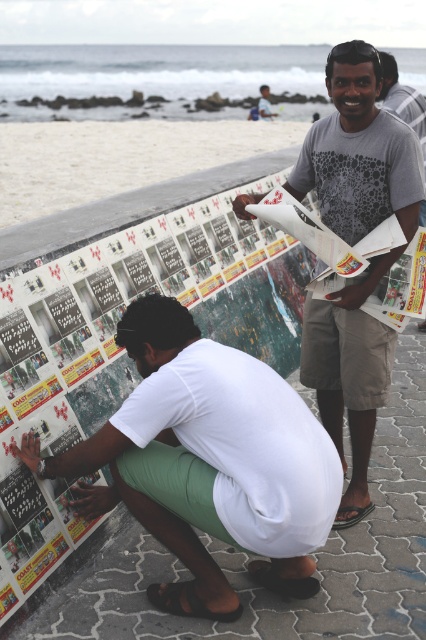
Question: Is gray dotted t-shirt at upper center wider than matte gray t-shirt at center?

Choices:
 (A) yes
 (B) no

Answer: (A)

Question: Which of the following is the farthest from the observer?

Choices:
 (A) (264, 97)
 (B) (327, 204)
 (C) (147, 410)

Answer: (A)

Question: Is gray dotted t-shirt at upper center bigger than matte gray t-shirt at center?

Choices:
 (A) yes
 (B) no

Answer: (B)

Question: Which object appears closest to the camera in this image?

Choices:
 (A) white matte shirt at lower center
 (B) gray dotted t-shirt at upper center
 (C) matte gray t-shirt at center

Answer: (A)

Question: Does white matte shirt at lower center have a lesser width compared to matte gray t-shirt at center?

Choices:
 (A) no
 (B) yes

Answer: (A)

Question: Among these objects, which one is nearest to the camera?

Choices:
 (A) white matte shirt at lower center
 (B) gray dotted t-shirt at upper center
 (C) matte gray t-shirt at center

Answer: (A)